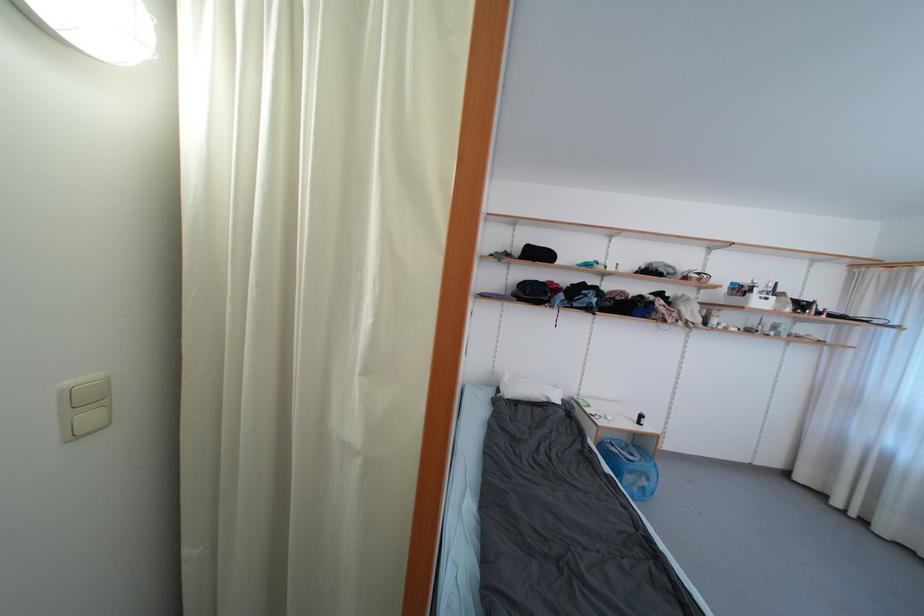
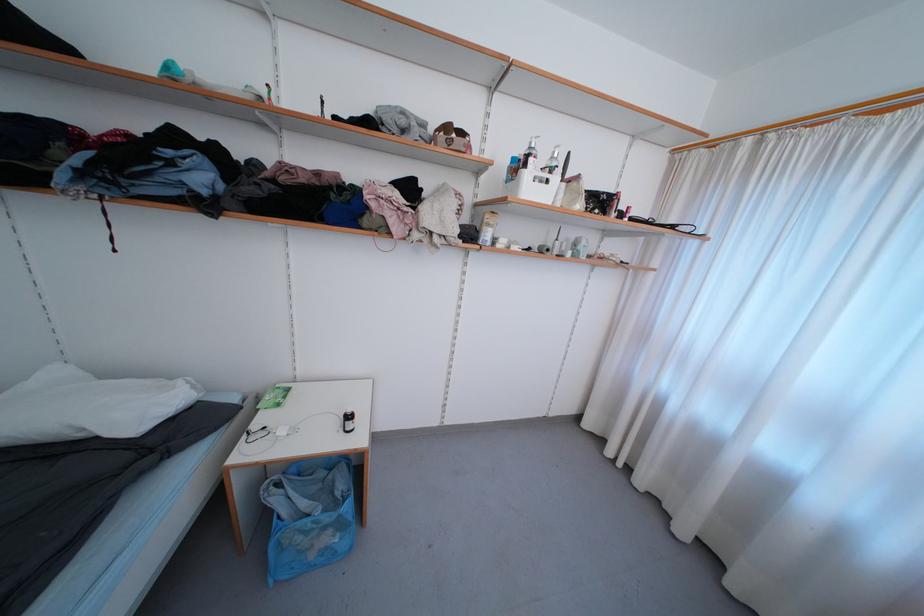
What movement of the cameraman would produce the second image?

The cameraman moved toward right, forward.